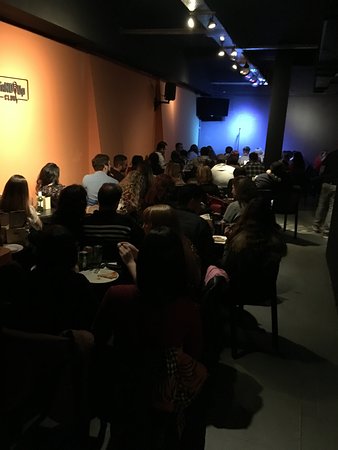
Identify the location of walls. click(x=58, y=97), click(x=188, y=112), click(x=304, y=117).